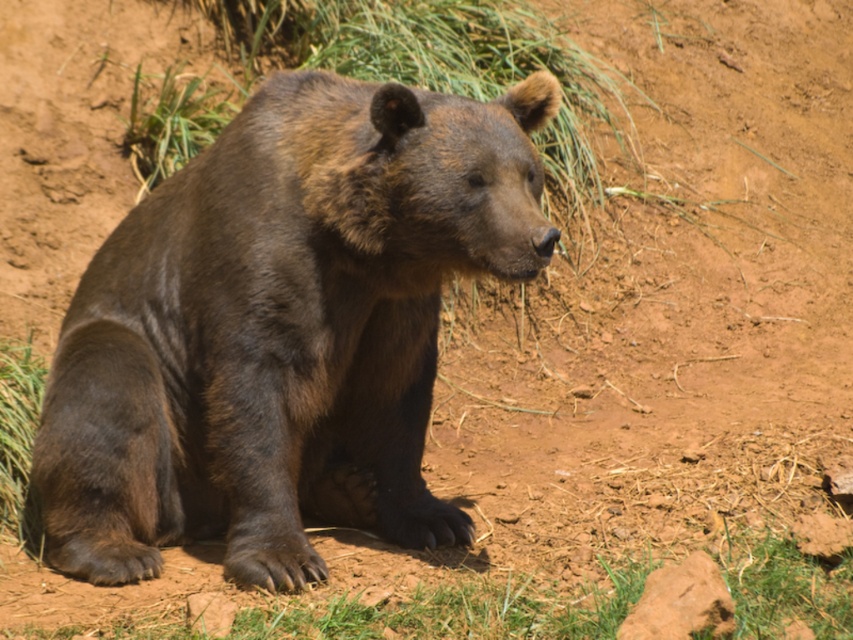
What do you see at coordinates (171, 122) in the screenshot? This screenshot has height=640, width=853. I see `green grass at upper left` at bounding box center [171, 122].

Between green grass at upper left and green grass at lower left, which one is positioned higher?

Positioned higher is green grass at upper left.

Does point (229, 109) come farther from viewer compared to point (28, 387)?

Yes, point (229, 109) is behind point (28, 387).

Identify the location of green grass at upper left. coord(171,122).

The image size is (853, 640). What are the coordinates of `brown furry bear at center` in the screenshot? It's located at (282, 328).

Does point (399, 444) come behind point (602, 627)?

Yes, it is behind point (602, 627).

Find the location of a particular element. Image resolution: width=853 pixels, height=640 pixels. brown furry bear at center is located at coordinates (282, 328).

Is point (608, 582) more distant than point (204, 125)?

No, (608, 582) is in front of (204, 125).

Which of these two, green grass at lower center or green grass at upper left, stands taller?

green grass at upper left is taller.

Is point (525, 593) positioned behind point (224, 116)?

That is False.

Where is `green grass at lower center`? green grass at lower center is located at coordinates (457, 609).